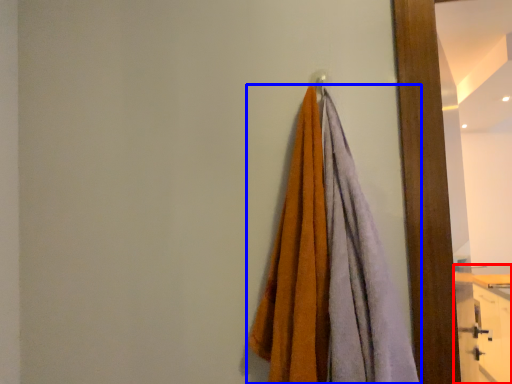
Question: Which point is further to the camera, dresser (highlighted by a red box) or towel (highlighted by a blue box)?

Choices:
 (A) dresser
 (B) towel

Answer: (A)